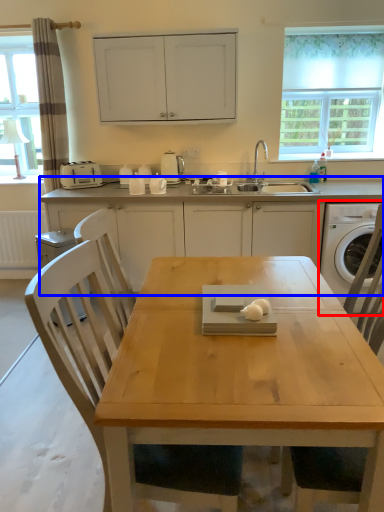
Question: Which object appears farthest to the camera in this image, washing machine (highlighted by a red box) or cabinetry (highlighted by a blue box)?

Choices:
 (A) washing machine
 (B) cabinetry

Answer: (B)